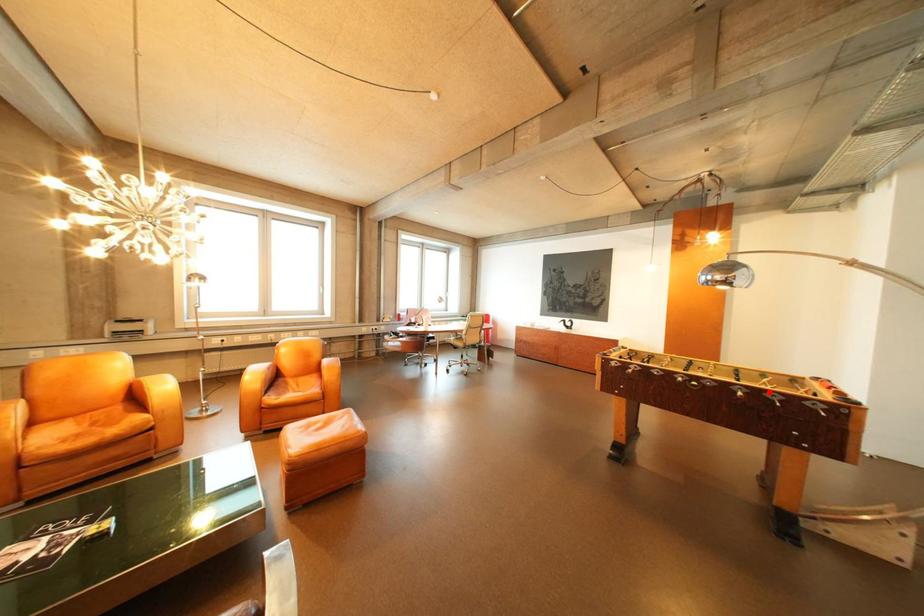
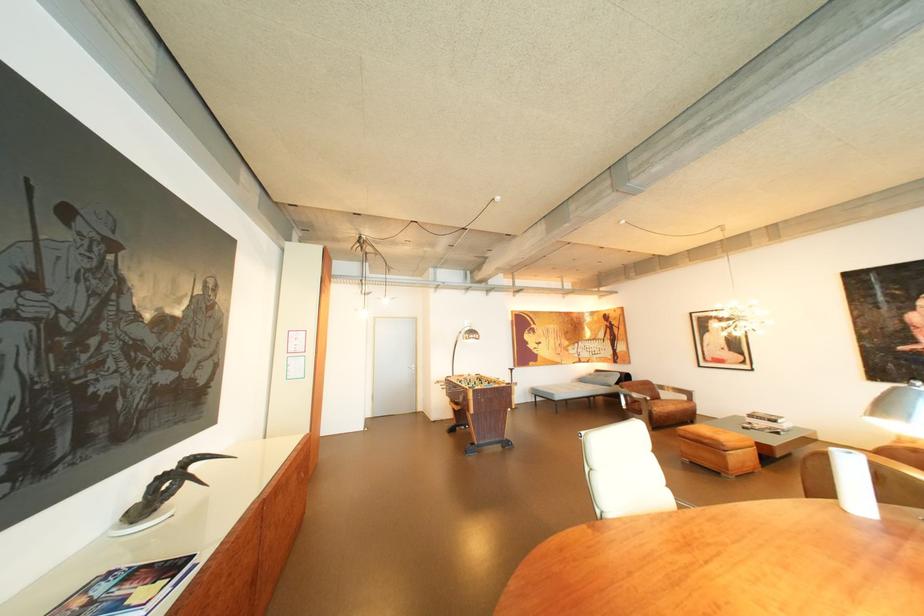
Question: I am providing you with two images of the same scene from different viewpoints. A red point is marked on the first image. Can you still see the location of the red point in image 2?

Choices:
 (A) Yes
 (B) No

Answer: (B)